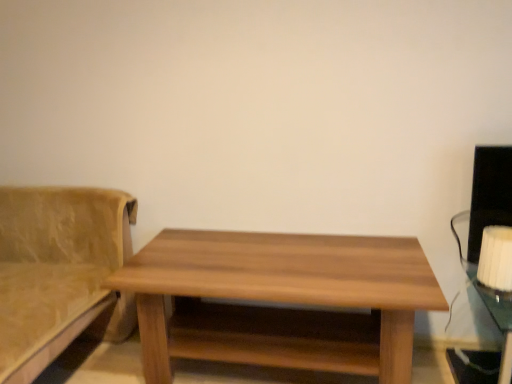
Question: Would you consider wooden table at center to be distant from white fabric lampshade at right?

Choices:
 (A) no
 (B) yes

Answer: (A)

Question: From the image's perspective, is wooden table at center under white fabric lampshade at right?

Choices:
 (A) no
 (B) yes

Answer: (B)

Question: Considering the relative sizes of wooden table at center and white fabric lampshade at right in the image provided, is wooden table at center bigger than white fabric lampshade at right?

Choices:
 (A) yes
 (B) no

Answer: (A)

Question: Is the depth of wooden table at center greater than that of white fabric lampshade at right?

Choices:
 (A) yes
 (B) no

Answer: (B)

Question: From a real-world perspective, is wooden table at center on white fabric lampshade at right?

Choices:
 (A) no
 (B) yes

Answer: (A)

Question: From their relative heights in the image, would you say suede-like beige couch at left is taller or shorter than white fabric lampshade at right?

Choices:
 (A) short
 (B) tall

Answer: (B)

Question: In the image, is suede-like beige couch at left positioned in front of or behind white fabric lampshade at right?

Choices:
 (A) front
 (B) behind

Answer: (A)

Question: Considering the positions of suede-like beige couch at left and white fabric lampshade at right in the image, is suede-like beige couch at left bigger or smaller than white fabric lampshade at right?

Choices:
 (A) big
 (B) small

Answer: (A)

Question: Is suede-like beige couch at left situated inside white fabric lampshade at right or outside?

Choices:
 (A) inside
 (B) outside

Answer: (B)

Question: Is suede-like beige couch at left inside or outside of wooden table at center?

Choices:
 (A) inside
 (B) outside

Answer: (B)

Question: In the image, is suede-like beige couch at left on the left side or the right side of wooden table at center?

Choices:
 (A) left
 (B) right

Answer: (A)

Question: In the image, is suede-like beige couch at left positioned in front of or behind wooden table at center?

Choices:
 (A) front
 (B) behind

Answer: (A)

Question: From a real-world perspective, is suede-like beige couch at left physically located above or below wooden table at center?

Choices:
 (A) above
 (B) below

Answer: (A)

Question: From a real-world perspective, is white fabric lampshade at right physically located above or below suede-like beige couch at left?

Choices:
 (A) below
 (B) above

Answer: (B)

Question: In terms of height, does white fabric lampshade at right look taller or shorter compared to suede-like beige couch at left?

Choices:
 (A) short
 (B) tall

Answer: (A)